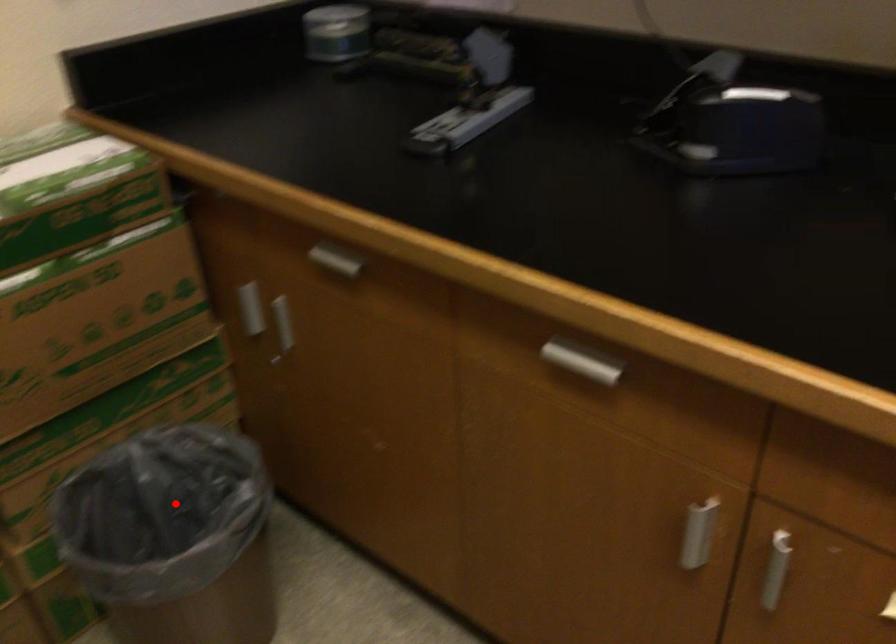
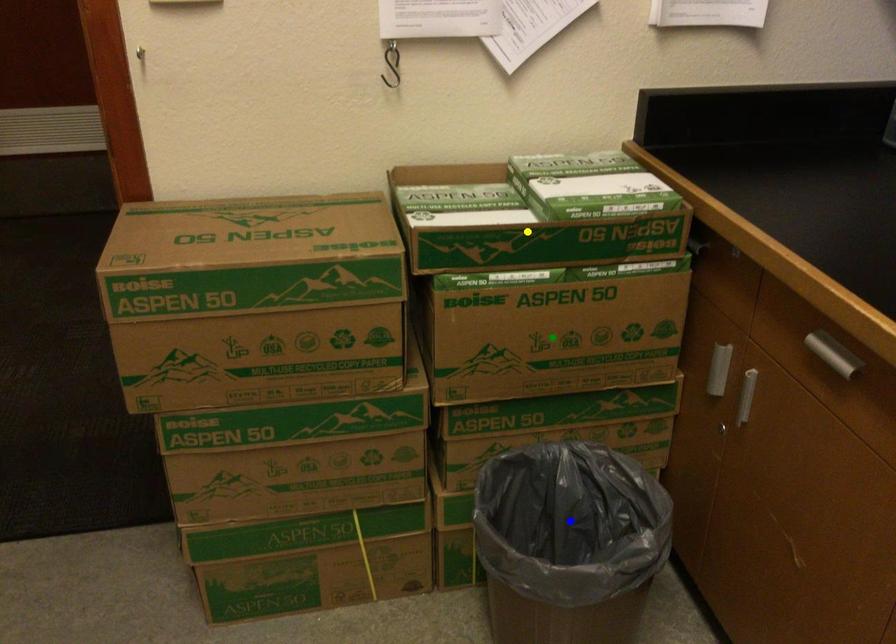
Question: I am providing you with two images of the same scene from different viewpoints. A red point is marked on the first image. You are given multiple points on the second image. Which point in image 2 is actually the same real-world point as the red point in image 1?

Choices:
 (A) yellow point
 (B) green point
 (C) blue point

Answer: (C)